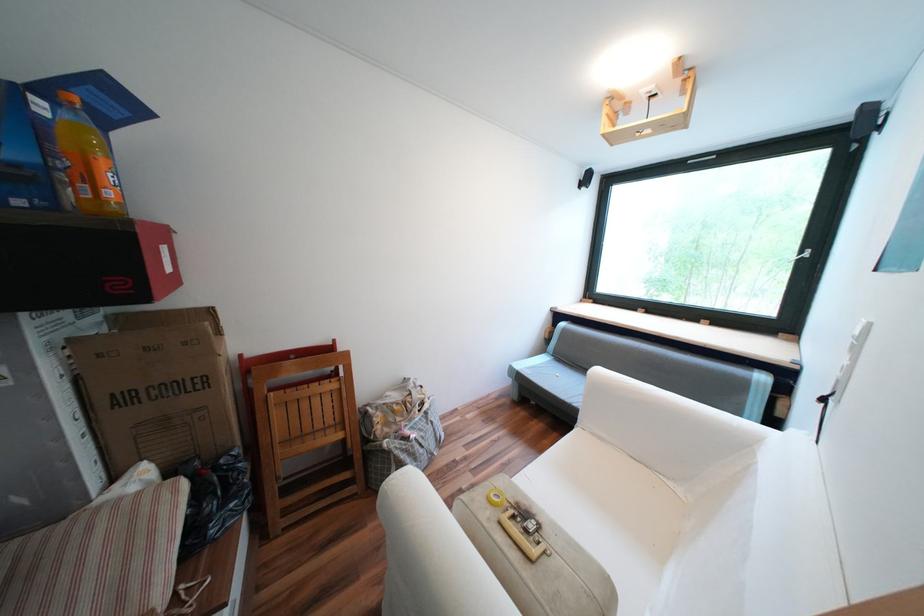
Find the location of `case latch switch`. case latch switch is located at coordinates (521, 538).